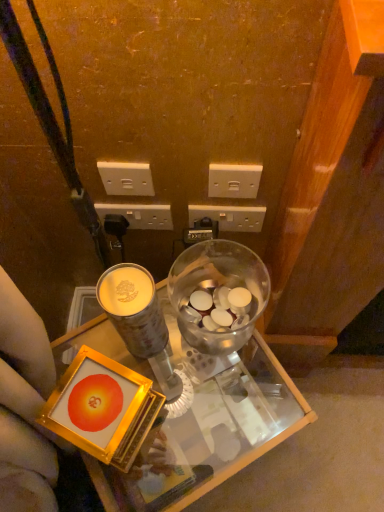
Question: Is white plastic power outlet at upper center, placed as the 4th power outlet when sorted from right to left, touching white plastic power outlet at center, the second power outlet from the right?

Choices:
 (A) no
 (B) yes

Answer: (A)

Question: From a real-world perspective, is white plastic power outlet at upper center, marked as the 1th power outlet in a left-to-right arrangement, physically above white plastic power outlet at center, which is the third power outlet from left to right?

Choices:
 (A) yes
 (B) no

Answer: (A)

Question: Can you confirm if white plastic power outlet at upper center, marked as the 1th power outlet in a left-to-right arrangement, is bigger than white plastic power outlet at center, the second power outlet from the right?

Choices:
 (A) yes
 (B) no

Answer: (B)

Question: Could you tell me if white plastic power outlet at upper center, placed as the 4th power outlet when sorted from right to left, is turned towards white plastic power outlet at center, the second power outlet from the right?

Choices:
 (A) no
 (B) yes

Answer: (A)

Question: Does white plastic power outlet at upper center, marked as the 1th power outlet in a left-to-right arrangement, have a lesser width compared to white plastic power outlet at center, the second power outlet from the right?

Choices:
 (A) yes
 (B) no

Answer: (A)

Question: Does white plastic power outlet at upper center, marked as the 1th power outlet in a left-to-right arrangement, have a greater height compared to white plastic power outlet at center, which is the third power outlet from left to right?

Choices:
 (A) yes
 (B) no

Answer: (B)

Question: From a real-world perspective, is white plastic power outlet at center, the 2th power outlet viewed from the left, located beneath translucent glass jar at center?

Choices:
 (A) yes
 (B) no

Answer: (A)

Question: Is white plastic power outlet at center, the 2th power outlet viewed from the left, to the right of translucent glass jar at center from the viewer's perspective?

Choices:
 (A) yes
 (B) no

Answer: (B)

Question: From a real-world perspective, is white plastic power outlet at center, the third power outlet positioned from the right, over translucent glass jar at center?

Choices:
 (A) no
 (B) yes

Answer: (A)

Question: Is white plastic power outlet at center, the 2th power outlet viewed from the left, surrounding translucent glass jar at center?

Choices:
 (A) yes
 (B) no

Answer: (B)

Question: Is white plastic power outlet at center, the 2th power outlet viewed from the left, behind translucent glass jar at center?

Choices:
 (A) no
 (B) yes

Answer: (B)

Question: From the image's perspective, would you say white plastic power outlet at center, the third power outlet positioned from the right, is positioned over translucent glass jar at center?

Choices:
 (A) no
 (B) yes

Answer: (B)

Question: Does white plastic power outlet at center, which is the third power outlet from left to right, come behind transparent glass desk at center?

Choices:
 (A) yes
 (B) no

Answer: (A)